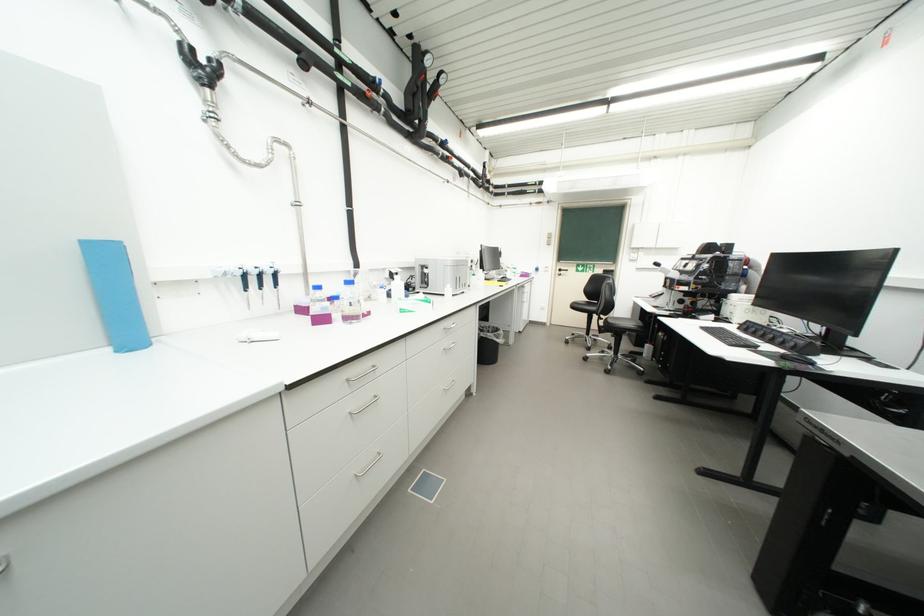
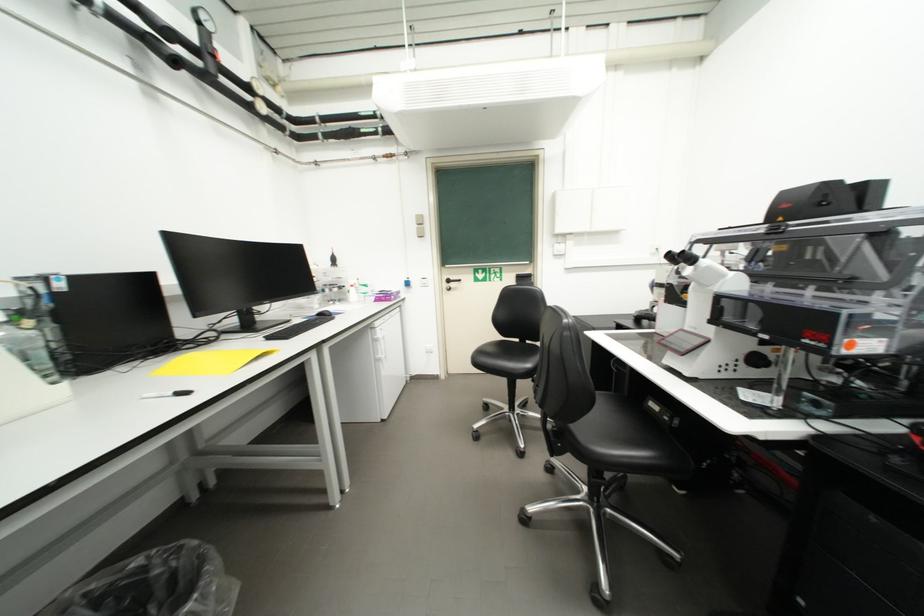
From the picture: What movement of the cameraman would produce the second image?

The cameraman moved toward right, forward.